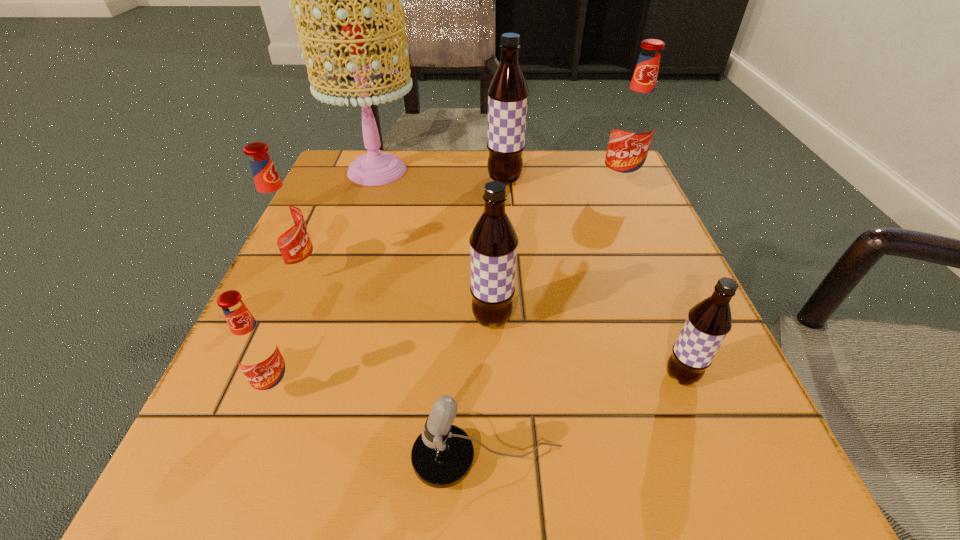
Where is `free space at the far left corner of the desktop`? This screenshot has height=540, width=960. free space at the far left corner of the desktop is located at coordinates coord(388,150).

Find the location of a particular element. The height and width of the screenshot is (540, 960). vacant space at the near left corner of the desktop is located at coordinates (157, 507).

Find the location of a particular element. vacant area at the far right corner of the desktop is located at coordinates (582, 200).

This screenshot has width=960, height=540. In order to click on free point at the near right corner in this screenshot , I will do `click(693, 470)`.

Locate an element on the screen. The image size is (960, 540). free space that is in between the lampshade and the biggest brown root beer is located at coordinates (441, 175).

Where is `unoccupied position between the nearest brown root beer and the biggest brown root beer`? unoccupied position between the nearest brown root beer and the biggest brown root beer is located at coordinates (592, 278).

Find the location of a particular element. The width and height of the screenshot is (960, 540). free space between the rightmost red root beer and the second smallest brown root beer is located at coordinates (555, 253).

The width and height of the screenshot is (960, 540). I want to click on vacant space that is in between the second smallest brown root beer and the nearest object, so click(491, 391).

Image resolution: width=960 pixels, height=540 pixels. What are the coordinates of `free space between the nearest brown root beer and the biggest brown root beer` in the screenshot? It's located at (592, 278).

What are the coordinates of `vacant area that lies between the farthest brown root beer and the farthest red root beer` in the screenshot? It's located at (562, 184).